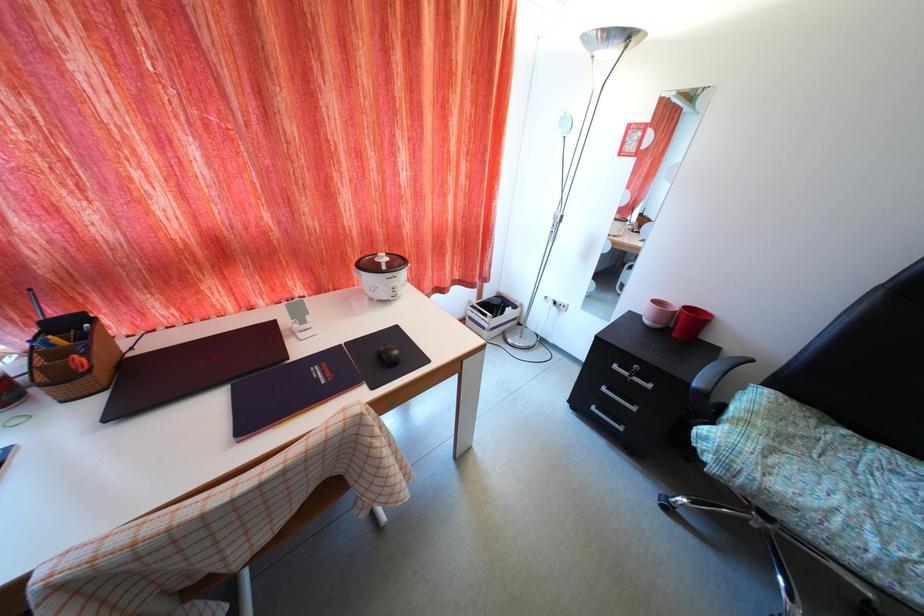
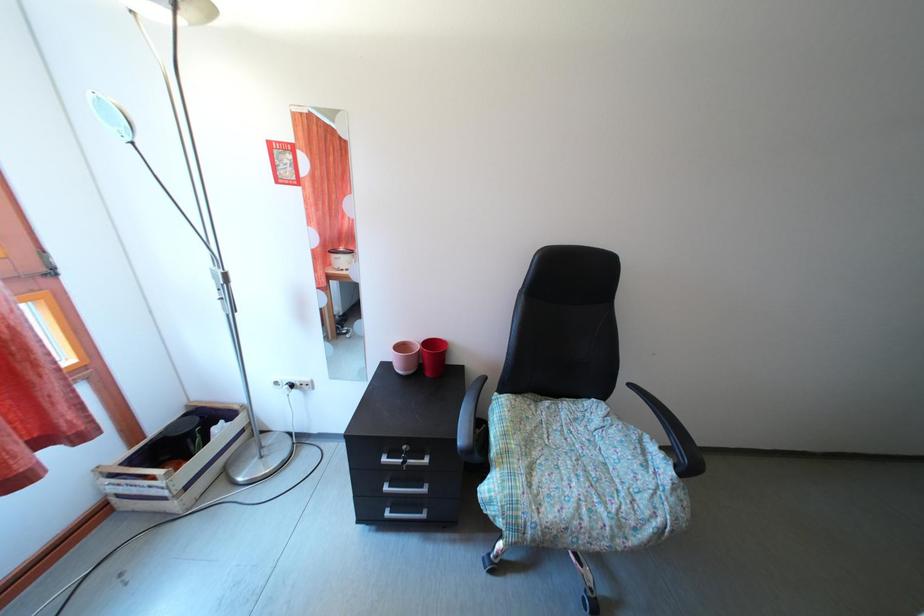
Question: The camera is either moving clockwise (left) or counter-clockwise (right) around the object. The first image is from the beginning of the video and the second image is from the end. Is the camera moving left or right when shooting the video?

Choices:
 (A) Left
 (B) Right

Answer: (A)